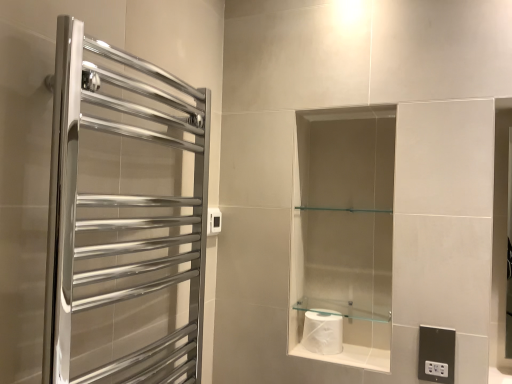
Question: Are polished chrome towel rack at left and white glossy toilet paper at lower center beside each other?

Choices:
 (A) no
 (B) yes

Answer: (A)

Question: Is polished chrome towel rack at left to the left of white glossy toilet paper at lower center from the viewer's perspective?

Choices:
 (A) yes
 (B) no

Answer: (A)

Question: Can we say polished chrome towel rack at left lies outside white glossy toilet paper at lower center?

Choices:
 (A) yes
 (B) no

Answer: (A)

Question: Does polished chrome towel rack at left have a lesser height compared to white glossy toilet paper at lower center?

Choices:
 (A) yes
 (B) no

Answer: (B)

Question: From the image's perspective, is polished chrome towel rack at left located beneath white glossy toilet paper at lower center?

Choices:
 (A) no
 (B) yes

Answer: (A)

Question: In terms of height, does clear glass shelf at center look taller or shorter compared to white plastic electric outlet at upper center, marked as the first electric outlet in a back-to-front arrangement?

Choices:
 (A) short
 (B) tall

Answer: (A)

Question: In terms of size, does clear glass shelf at center appear bigger or smaller than white plastic electric outlet at upper center, the 2th electric outlet from the right?

Choices:
 (A) small
 (B) big

Answer: (B)

Question: Is clear glass shelf at center situated inside white plastic electric outlet at upper center, marked as the first electric outlet in a back-to-front arrangement, or outside?

Choices:
 (A) inside
 (B) outside

Answer: (B)

Question: From the image's perspective, is clear glass shelf at center positioned above or below white plastic electric outlet at upper center, marked as the first electric outlet in a back-to-front arrangement?

Choices:
 (A) above
 (B) below

Answer: (B)

Question: Considering the positions of white glossy toilet paper at lower center and clear glass shelf at center in the image, is white glossy toilet paper at lower center wider or thinner than clear glass shelf at center?

Choices:
 (A) wide
 (B) thin

Answer: (A)

Question: Which is correct: white glossy toilet paper at lower center is inside clear glass shelf at center, or outside of it?

Choices:
 (A) inside
 (B) outside

Answer: (B)

Question: From the image's perspective, is white glossy toilet paper at lower center positioned above or below clear glass shelf at center?

Choices:
 (A) below
 (B) above

Answer: (A)

Question: In terms of size, does white glossy toilet paper at lower center appear bigger or smaller than clear glass shelf at center?

Choices:
 (A) big
 (B) small

Answer: (A)

Question: Based on their positions, is clear glass shelf at center located to the left or right of white glossy toilet paper at center?

Choices:
 (A) right
 (B) left

Answer: (A)

Question: From a real-world perspective, relative to white glossy toilet paper at center, is clear glass shelf at center vertically above or below?

Choices:
 (A) below
 (B) above

Answer: (B)